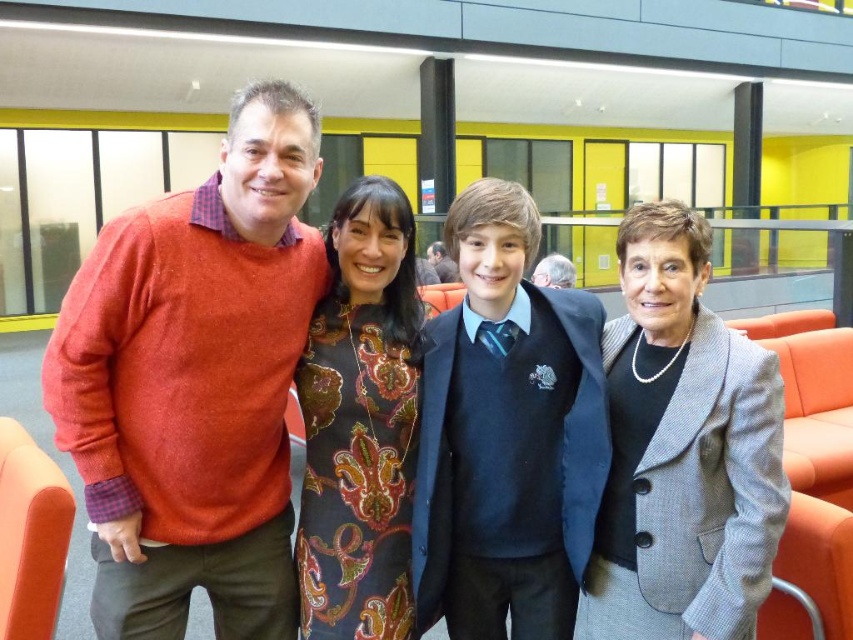
In the image, there are a man in a red sweater over a plaid shirt, a woman in a patterned dress, and a matte blue sweater at center. Which of these items is located at the coordinates 0.680, 0.594?

The matte blue sweater at center is located at the coordinates (506, 435).

Looking at this image, you are an observer looking at the group of people in the scene. Which of the two sweaters, the matte red sweater at left or the matte blue sweater at center, is positioned higher up in the image?

The matte red sweater at left is positioned higher up in the image than the matte blue sweater at center.

You are an interior designer assessing the spatial compatibility of two sweaters in a room. The scene shows a matte red sweater at left and a matte blue sweater at center. Which sweater has a greater width?

The matte red sweater at left has a greater width than the matte blue sweater at center, as stated in the description.